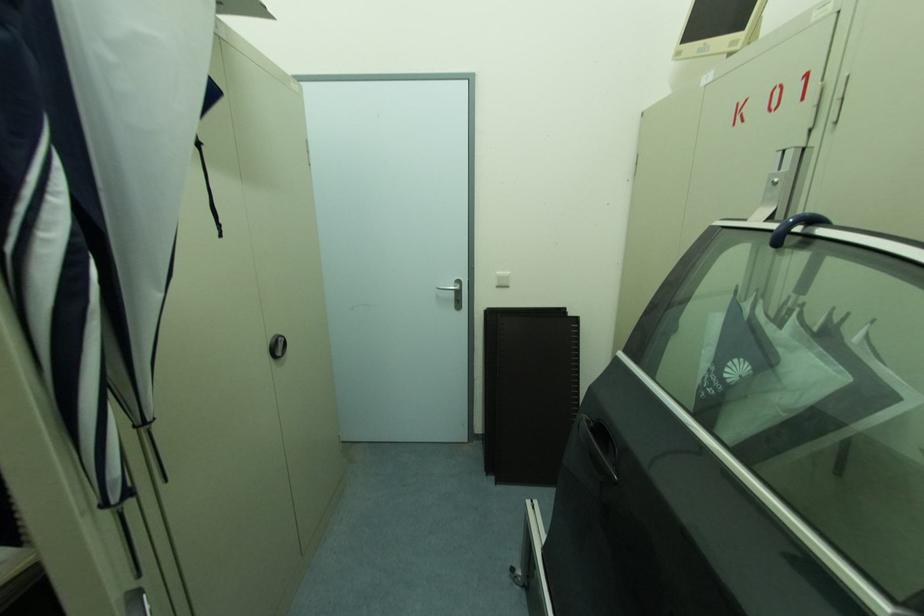
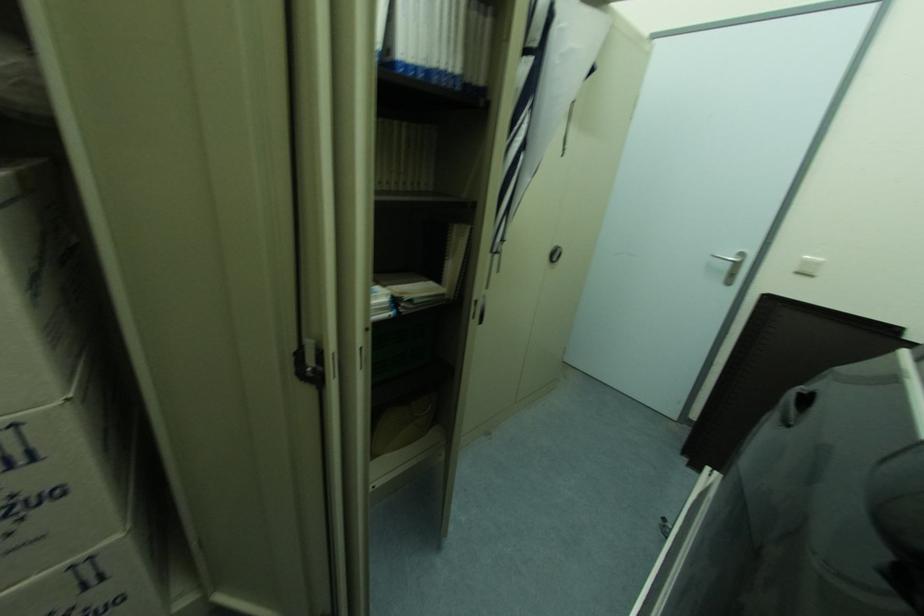
Question: Based on the continuous images, in which direction is the camera rotating? Reply with the corresponding letter.

Choices:
 (A) Left
 (B) Right
 (C) Up
 (D) Down

Answer: (A)